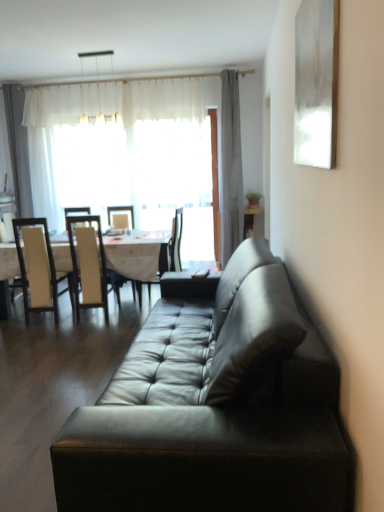
Question: Considering the relative sizes of white sheer curtain at upper left and leather couch at center in the image provided, is white sheer curtain at upper left wider than leather couch at center?

Choices:
 (A) no
 (B) yes

Answer: (A)

Question: From a real-world perspective, is white sheer curtain at upper left on leather couch at center?

Choices:
 (A) yes
 (B) no

Answer: (A)

Question: Does white sheer curtain at upper left come in front of leather couch at center?

Choices:
 (A) no
 (B) yes

Answer: (A)

Question: From a real-world perspective, is white sheer curtain at upper left positioned under leather couch at center based on gravity?

Choices:
 (A) no
 (B) yes

Answer: (A)

Question: Is white sheer curtain at upper left bigger than leather couch at center?

Choices:
 (A) no
 (B) yes

Answer: (A)

Question: Choose the correct answer: Is black leather chair at center, acting as the first chair starting from the right, inside gray fabric curtain at upper center or outside it?

Choices:
 (A) outside
 (B) inside

Answer: (A)

Question: Considering the positions of black leather chair at center, acting as the first chair starting from the right, and gray fabric curtain at upper center in the image, is black leather chair at center, acting as the first chair starting from the right, bigger or smaller than gray fabric curtain at upper center?

Choices:
 (A) big
 (B) small

Answer: (B)

Question: Is point (178, 237) positioned closer to the camera than point (238, 120)?

Choices:
 (A) farther
 (B) closer

Answer: (B)

Question: In the image, is black leather chair at center, which ranks as the 3th chair in left-to-right order, on the left side or the right side of gray fabric curtain at upper center?

Choices:
 (A) left
 (B) right

Answer: (A)

Question: Relative to gray fabric curtain at upper center, is leather couch at center in front or behind?

Choices:
 (A) front
 (B) behind

Answer: (A)

Question: Is leather couch at center inside the boundaries of gray fabric curtain at upper center, or outside?

Choices:
 (A) inside
 (B) outside

Answer: (B)

Question: Based on their positions, is leather couch at center located to the left or right of gray fabric curtain at upper center?

Choices:
 (A) left
 (B) right

Answer: (A)

Question: Considering the positions of leather couch at center and gray fabric curtain at upper center in the image, is leather couch at center taller or shorter than gray fabric curtain at upper center?

Choices:
 (A) short
 (B) tall

Answer: (A)

Question: In terms of width, does white leather chair at left, marked as the 2th chair in a right-to-left arrangement, look wider or thinner when compared to white glossy table at center?

Choices:
 (A) thin
 (B) wide

Answer: (A)

Question: Considering the positions of white leather chair at left, marked as the 2th chair in a right-to-left arrangement, and white glossy table at center in the image, is white leather chair at left, marked as the 2th chair in a right-to-left arrangement, bigger or smaller than white glossy table at center?

Choices:
 (A) big
 (B) small

Answer: (B)